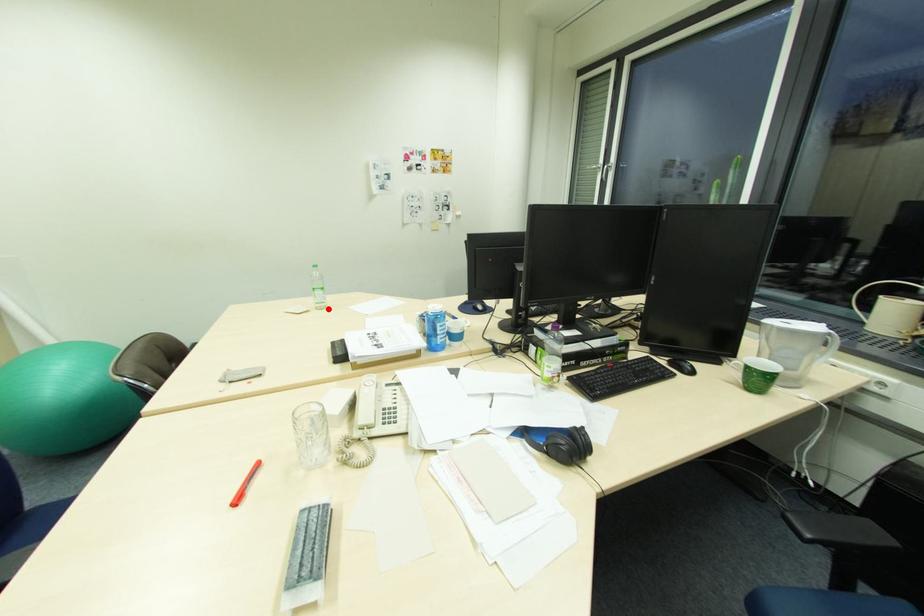
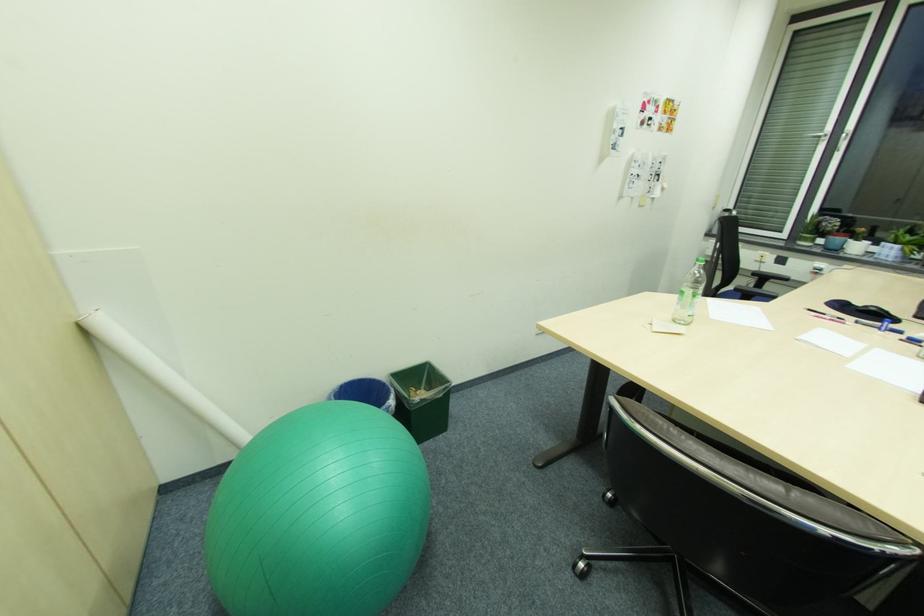
In the second image, find the point that corresponds to the highlighted location in the first image.

(688, 323)